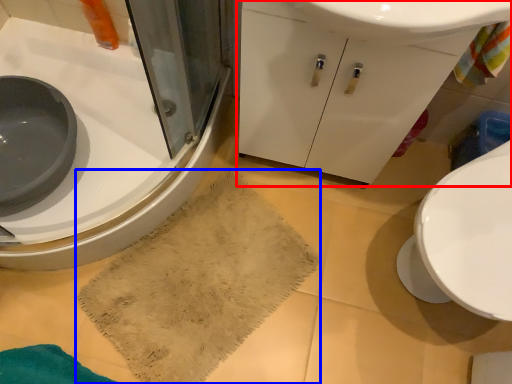
Question: Which point is closer to the camera, bathroom cabinet (highlighted by a red box) or bath towel (highlighted by a blue box)?

Choices:
 (A) bathroom cabinet
 (B) bath towel

Answer: (A)